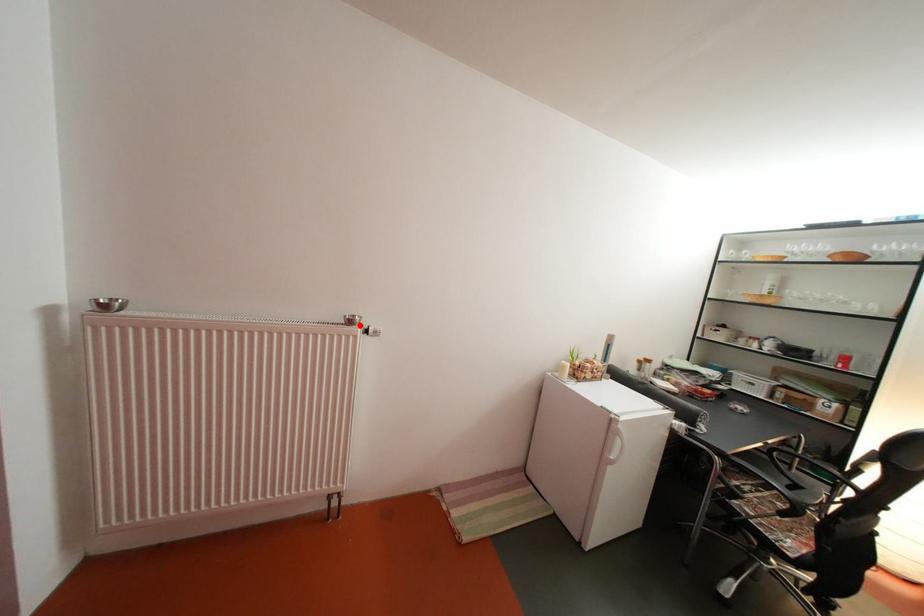
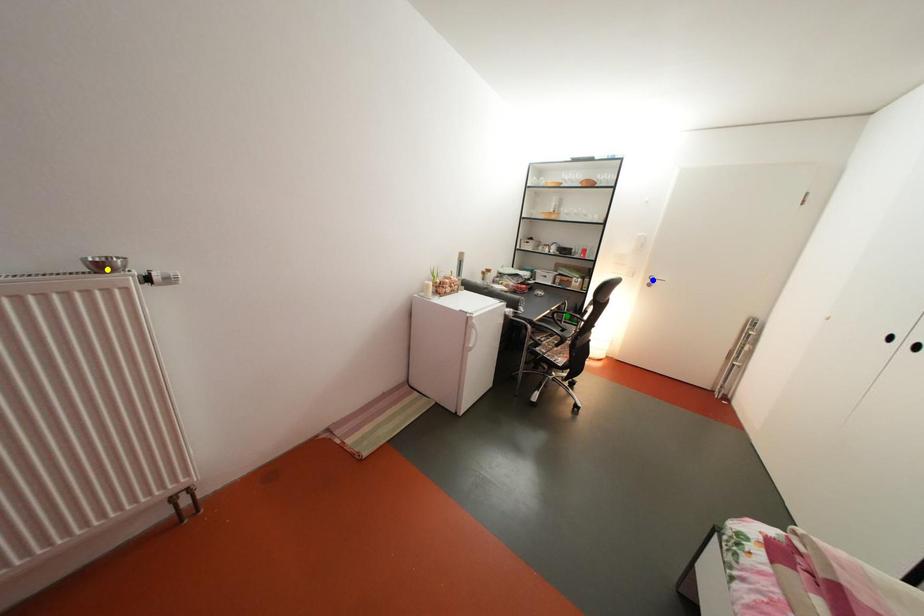
Question: I am providing you with two images of the same scene from different viewpoints. A red point is marked on the first image. You are given multiple points on the second image. Which point in image 2 is actually the same real-world point as the red point in image 1?

Choices:
 (A) blue point
 (B) green point
 (C) yellow point

Answer: (C)